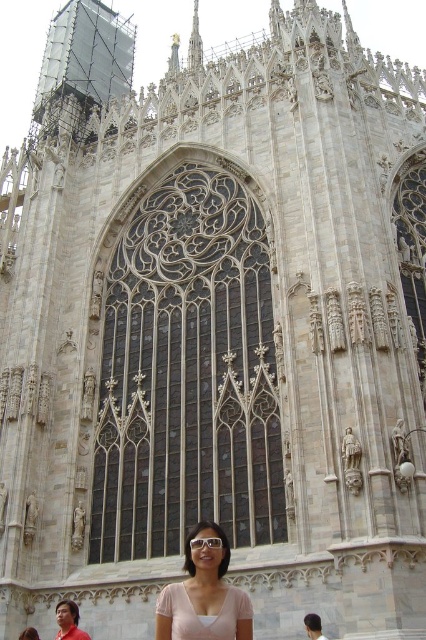
You are standing in front of the cathedral and notice the dark stained glass at center and the matte pink blouse at lower center. Which object is positioned higher in the scene?

The dark stained glass at center is positioned higher than the matte pink blouse at lower center.